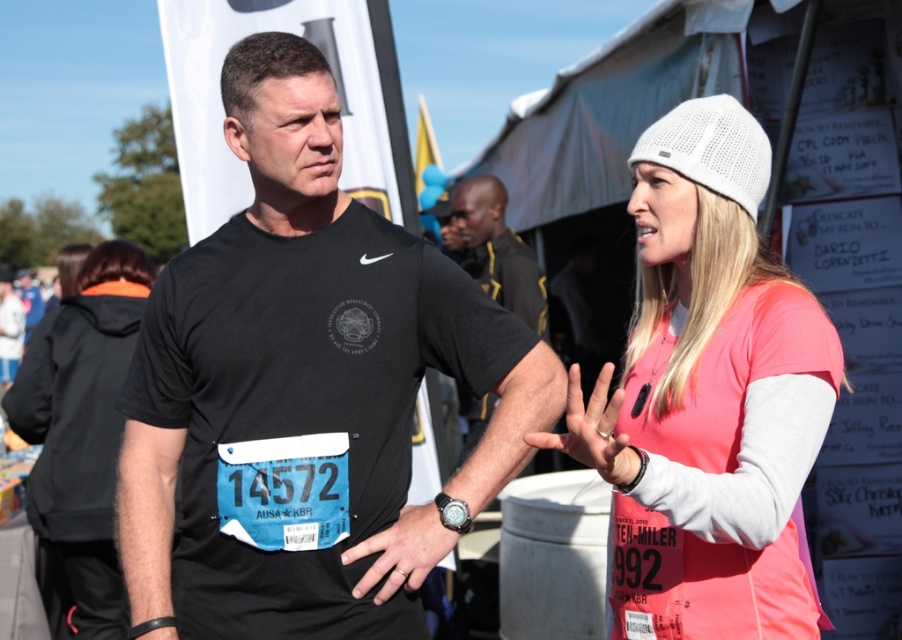
You are a participant in the race and need to check your time. Where is the black leather watch at center located on your body?

The black leather watch at center is located on the left wrist of the man on the left, as described in the scene.